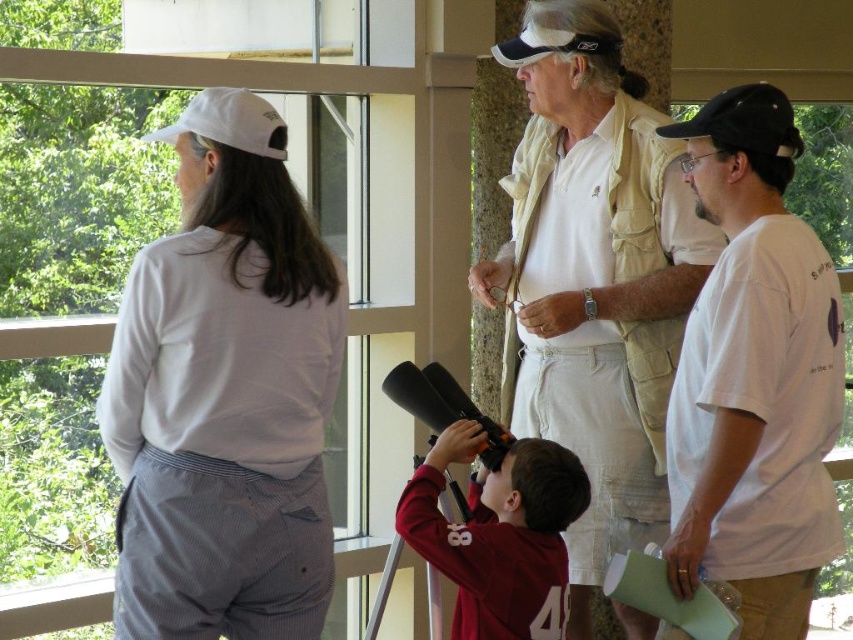
You are a photographer trying to capture both the black fabric baseball cap at upper right and the white fabric baseball cap at upper left in a single photo. Which cap should you focus on first to ensure both are in focus?

You should focus on the black fabric baseball cap at upper right first because it is closer to you than the white fabric baseball cap at upper left, so focusing on the closer object will help both be in focus.

You are a visitor trying to locate two baseball caps in the image. The black fabric baseball cap at upper right and the white fabric baseball cap at upper left. Which one is positioned higher in the image?

The black fabric baseball cap at upper right is positioned higher in the image than the white fabric baseball cap at upper left.